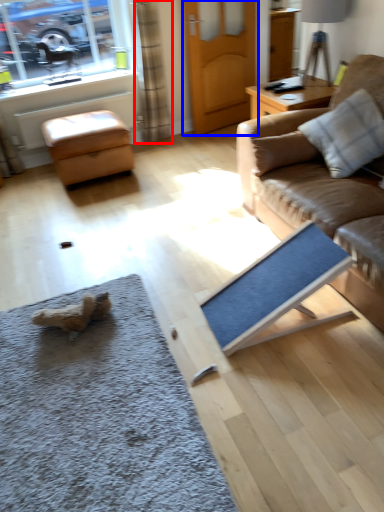
Question: Which of the following is the closest to the observer, curtain (highlighted by a red box) or door (highlighted by a blue box)?

Choices:
 (A) curtain
 (B) door

Answer: (A)